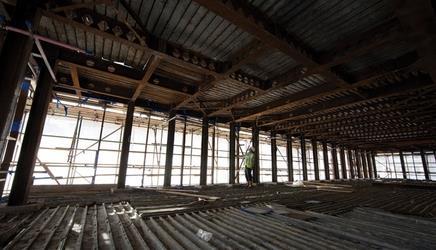
At what (x,y) coordinates should I click in order to perform the action: click on ceiling. Please return your answer as a coordinate pair (x, y). This screenshot has height=250, width=436. Looking at the image, I should click on (276, 57).